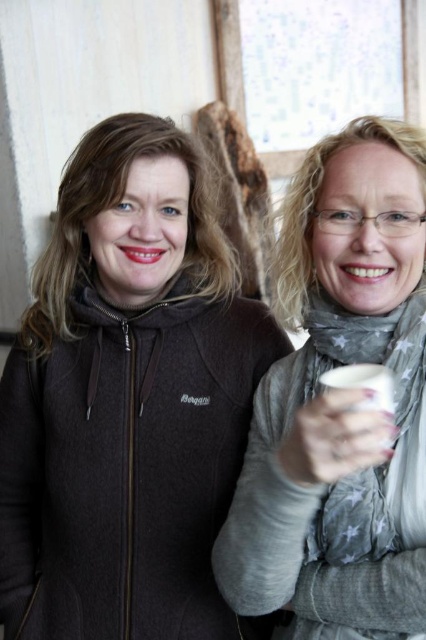
Is point (161, 304) farther from camera compared to point (264, 417)?

Yes, it is behind point (264, 417).

Does dark gray fleece jacket at left appear over white matte cup at center?

Actually, dark gray fleece jacket at left is below white matte cup at center.

Is point (189, 272) farther from camera compared to point (408, 253)?

Yes, it is.

Locate an element on the screen. The image size is (426, 640). dark gray fleece jacket at left is located at coordinates (127, 401).

Consider the image. Can you confirm if dark gray fleece jacket at left is wider than white glossy cup at center?

Indeed, dark gray fleece jacket at left has a greater width compared to white glossy cup at center.

What are the coordinates of `dark gray fleece jacket at left` in the screenshot? It's located at (127, 401).

At what (x,y) coordinates should I click in order to perform the action: click on dark gray fleece jacket at left. Please return your answer as a coordinate pair (x, y). Image resolution: width=426 pixels, height=640 pixels. Looking at the image, I should click on (127, 401).

Which is behind, point (288, 257) or point (305, 413)?

Point (288, 257)

Based on the photo, measure the distance between point (351, 134) and camera.

They are 35.87 inches apart.

Measure the distance between point (382, 128) and camera.

Point (382, 128) and camera are 34.96 inches apart.

Identify the location of white matte cup at center. Image resolution: width=426 pixels, height=640 pixels. (340, 403).